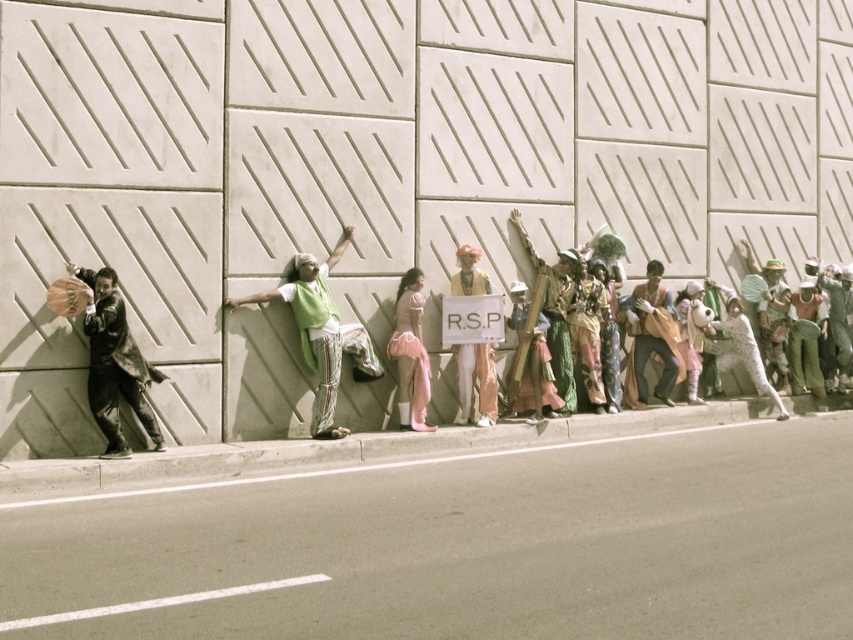
You are a photographer trying to capture the green fabric at center in the image. Based on the coordinates provided, can you confirm if the green fabric at center is located exactly at point (321, 332)?

Yes, the green fabric at center is located exactly at point (321, 332) as stated in the description.

You are a photographer standing at the center of the sidewalk. You want to take a photo that includes both the point at (436, 45) and the point at (91, 403). Which point should you focus on first to ensure both are in focus?

You should focus on the point at (436, 45) first because it is closer to the camera than the point at (91, 403). By focusing on the closer point, the depth of field will naturally include the farther point in focus as well.

You have to decide whether the white concrete wall at center can fit the white paper sign at center. Which one is wider?

The white concrete wall at center is wider than the white paper sign at center according to the description.